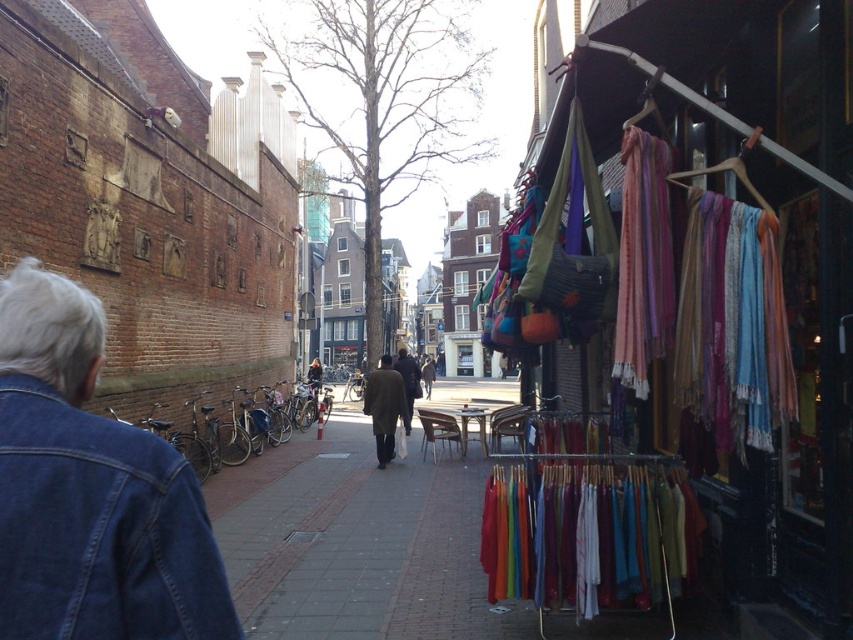
Between point (379, 369) and point (422, 376), which one is positioned in front?

Positioned in front is point (379, 369).

Locate an element on the screen. The image size is (853, 640). dark brown wool coat at center is located at coordinates (384, 406).

Where is `dark brown wool coat at center`? The width and height of the screenshot is (853, 640). dark brown wool coat at center is located at coordinates (384, 406).

Is the position of denim jacket at left less distant than that of dark brown leather jacket at center?

Yes, denim jacket at left is closer to the viewer.

Does denim jacket at left have a larger size compared to dark brown leather jacket at center?

Actually, denim jacket at left might be smaller than dark brown leather jacket at center.

I want to click on denim jacket at left, so point(90,490).

Identify the location of denim jacket at left. (90, 490).

Is point (688, 368) in front of point (405, 362)?

That is True.

Is point (582, 260) farther from viewer compared to point (416, 376)?

That is False.

Image resolution: width=853 pixels, height=640 pixels. What are the coordinates of `textured fabric scarves at right` in the screenshot? It's located at (712, 285).